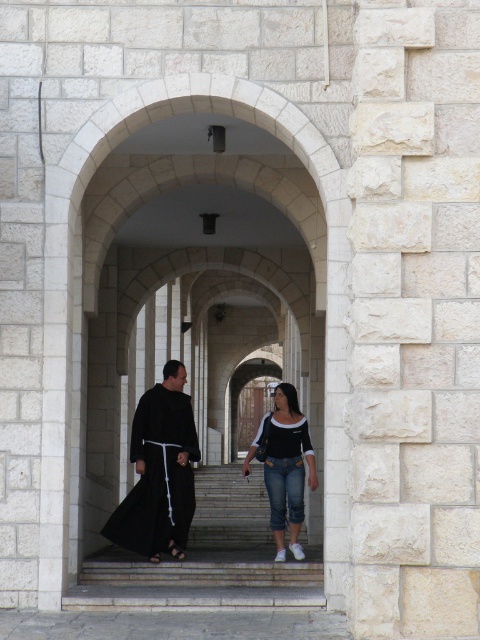
Looking at this image, you are standing at the entrance of the corridor and see a point marked at coordinates (159, 472). Based on the scene description, what is the most likely object or surface this point is located on?

The point is located on the black matte clothing at center, which is part of the traditional monastic attire of the person in the image.

Looking at this image, you are an architect analyzing the spatial layout of the corridor. You notice the black matte clothing at center and the denim jeans at center. Which object is closer to the entrance of the corridor?

The black matte clothing at center is closer to the entrance of the corridor because it is in front of the denim jeans at center.